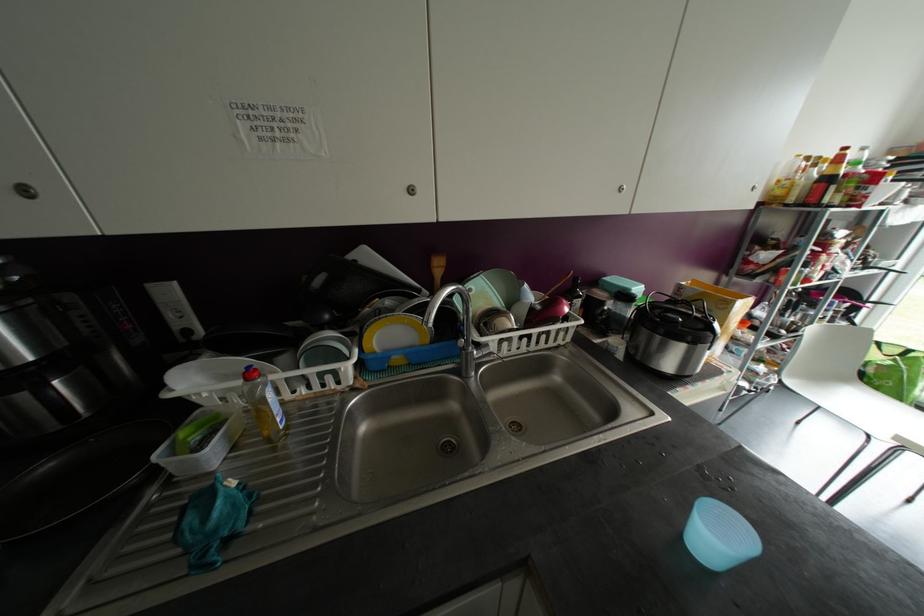
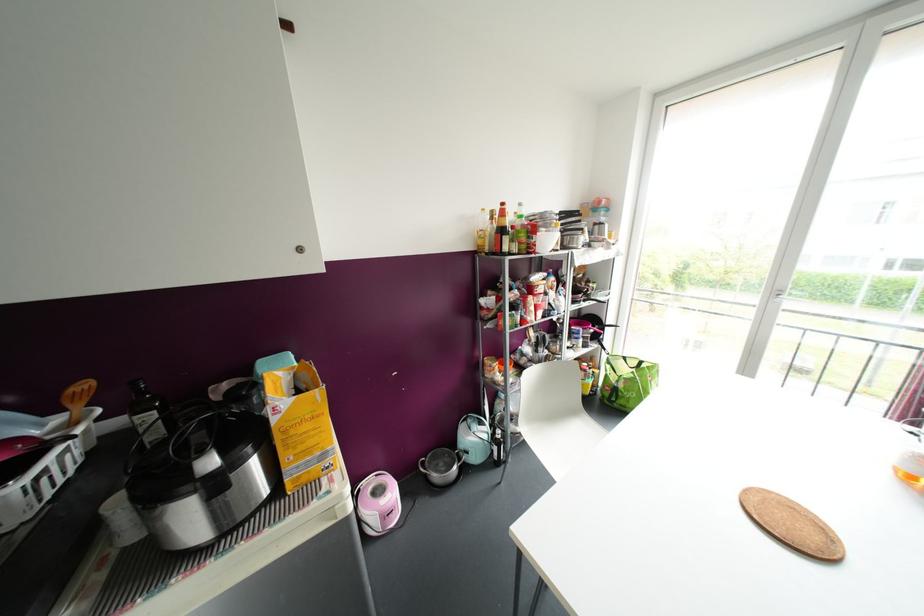
Locate, in the second image, the point that corresponds to pixel 879 342 in the first image.

(624, 358)